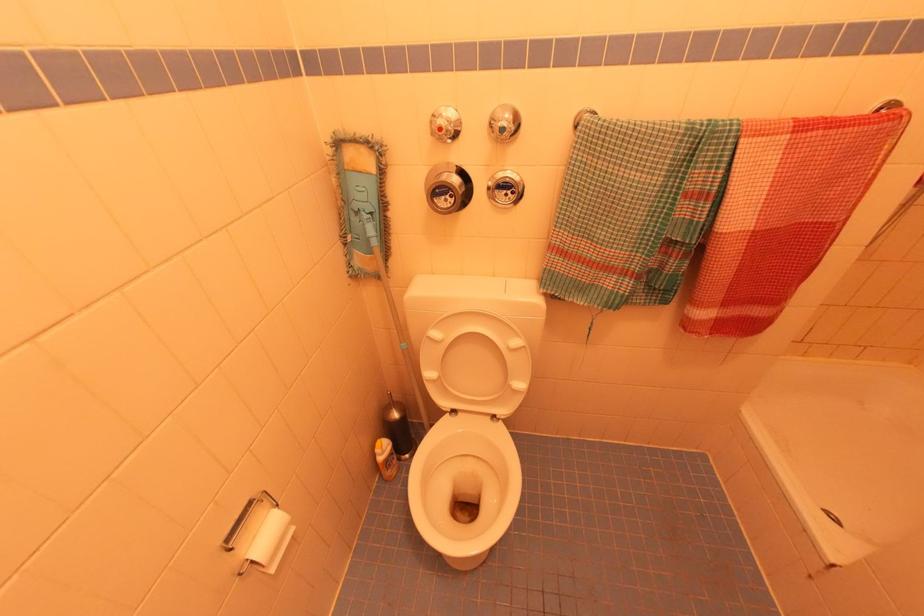
The height and width of the screenshot is (616, 924). What do you see at coordinates (385, 458) in the screenshot?
I see `the yellow cleaner bottle` at bounding box center [385, 458].